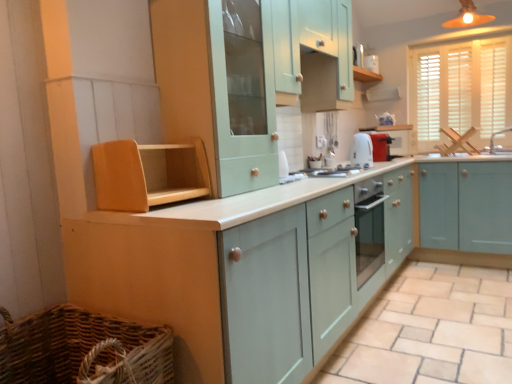
Question: Is woven brown basket at lower left positioned behind white glossy exhaust hood at upper center?

Choices:
 (A) yes
 (B) no

Answer: (B)

Question: Is woven brown basket at lower left positioned far away from white glossy exhaust hood at upper center?

Choices:
 (A) yes
 (B) no

Answer: (A)

Question: Are woven brown basket at lower left and white glossy exhaust hood at upper center beside each other?

Choices:
 (A) yes
 (B) no

Answer: (B)

Question: From the image's perspective, is woven brown basket at lower left on top of white glossy exhaust hood at upper center?

Choices:
 (A) no
 (B) yes

Answer: (A)

Question: From the image's perspective, does woven brown basket at lower left appear lower than white glossy exhaust hood at upper center?

Choices:
 (A) yes
 (B) no

Answer: (A)

Question: Relative to white glossy exhaust hood at upper center, is matte orange light fixture at upper right in front or behind?

Choices:
 (A) behind
 (B) front

Answer: (B)

Question: Is matte orange light fixture at upper right situated inside white glossy exhaust hood at upper center or outside?

Choices:
 (A) inside
 (B) outside

Answer: (B)

Question: Considering the positions of point (471, 9) and point (394, 97), is point (471, 9) closer or farther from the camera than point (394, 97)?

Choices:
 (A) closer
 (B) farther

Answer: (A)

Question: From the image's perspective, is matte orange light fixture at upper right positioned above or below white glossy exhaust hood at upper center?

Choices:
 (A) below
 (B) above

Answer: (B)

Question: From a real-world perspective, is mint green wood cabinet at upper center, placed as the 2th cabinetry when sorted from left to right, above or below woven brown basket at lower left?

Choices:
 (A) below
 (B) above

Answer: (B)

Question: Is mint green wood cabinet at upper center, which is the fourth cabinetry from right to left, inside the boundaries of woven brown basket at lower left, or outside?

Choices:
 (A) inside
 (B) outside

Answer: (B)

Question: Is mint green wood cabinet at upper center, placed as the 2th cabinetry when sorted from left to right, wider or thinner than woven brown basket at lower left?

Choices:
 (A) thin
 (B) wide

Answer: (A)

Question: Considering the positions of mint green wood cabinet at upper center, which is the fourth cabinetry from right to left, and woven brown basket at lower left in the image, is mint green wood cabinet at upper center, which is the fourth cabinetry from right to left, bigger or smaller than woven brown basket at lower left?

Choices:
 (A) small
 (B) big

Answer: (B)

Question: Is light beige tile at lower center in front of or behind white wood blinds at upper right in the image?

Choices:
 (A) behind
 (B) front

Answer: (B)

Question: Looking at the image, does light beige tile at lower center seem bigger or smaller compared to white wood blinds at upper right?

Choices:
 (A) big
 (B) small

Answer: (A)